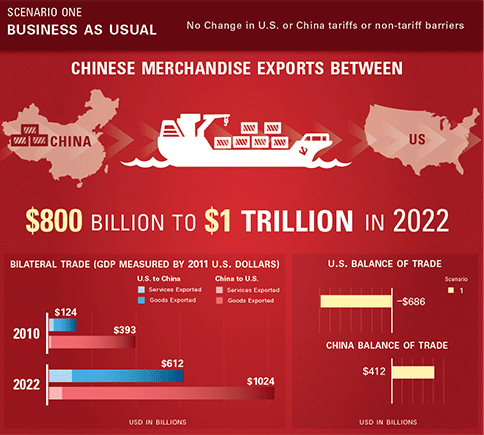
Find the location of a particular element. red bar is located at coordinates (132, 393), (97, 342).